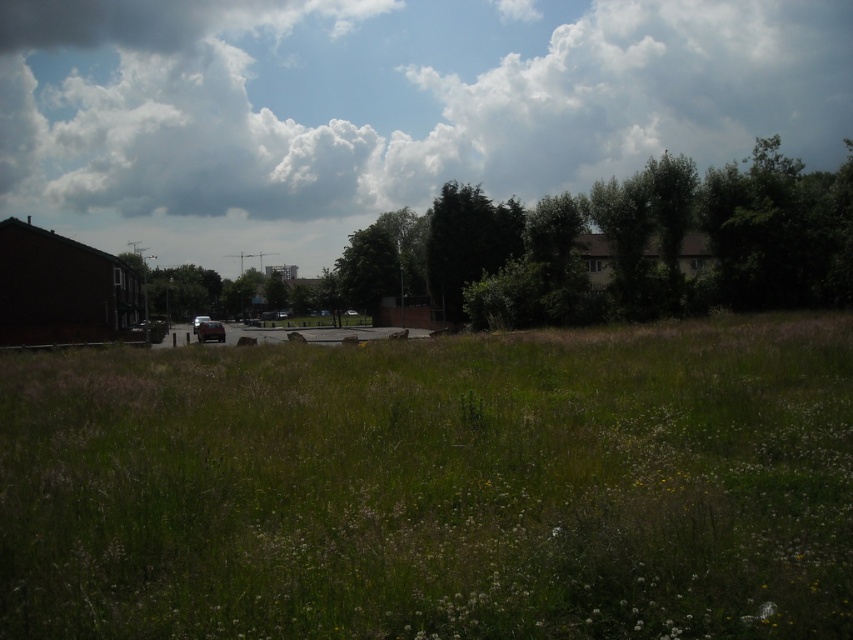
You are standing in the middle of the field and want to take a photo of the matte black car at center with the cloudy sky at upper center in the background. Which direction should you face to ensure both are visible in the frame?

You should face towards the right side of the matte black car at center so that the cloudy sky at upper center appears to the right of it in the frame, as per their spatial arrangement.

You are a bird looking for a nesting spot. You see the green leafy tree at upper center and the green leafy tree at center. Which tree would provide more space for your nest?

The green leafy tree at upper center is larger in size compared to the green leafy tree at center, so it would provide more space for your nest.

Based on the photo, you are a photographer setting up a tripod in the middle of the field. You want to frame both the green leafy tree at upper center and the matte black car at center in your shot. Which object should you position closer to the edge of your camera frame to ensure both fit within the view?

The matte black car at center should be positioned closer to the edge of the camera frame because the green leafy tree at upper center might be wider than the matte black car at center, so giving the tree more space in the frame will help both objects fit better.